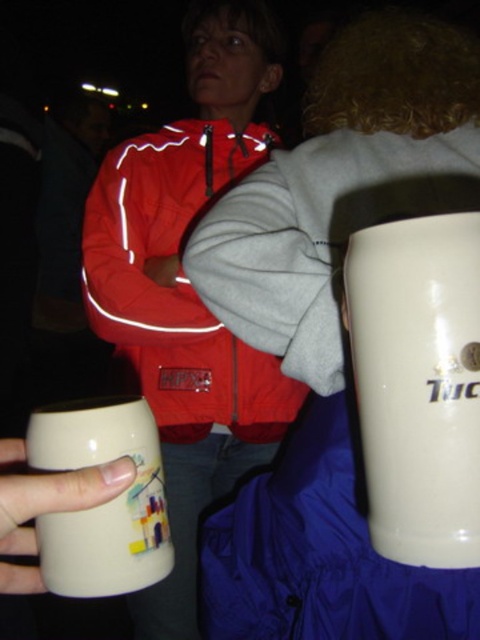
Can you confirm if white glossy mug at right is positioned to the right of matte ceramic mug at lower left?

Correct, you'll find white glossy mug at right to the right of matte ceramic mug at lower left.

Is point (458, 404) closer to viewer compared to point (109, 532)?

That is True.

This screenshot has height=640, width=480. I want to click on white glossy mug at right, so coord(419,385).

Who is shorter, white glossy mug at right or reflective red jacket at center?

white glossy mug at right is shorter.

Describe the element at coordinates (419, 385) in the screenshot. I see `white glossy mug at right` at that location.

The height and width of the screenshot is (640, 480). Identify the location of white glossy mug at right. (419, 385).

Can you confirm if reflective red jacket at center is wider than matte ceramic mug at lower left?

Yes, reflective red jacket at center is wider than matte ceramic mug at lower left.

Is point (164, 136) behind point (72, 460)?

Yes, it is.

Where is `reflective red jacket at center`? The image size is (480, 640). reflective red jacket at center is located at coordinates (178, 284).